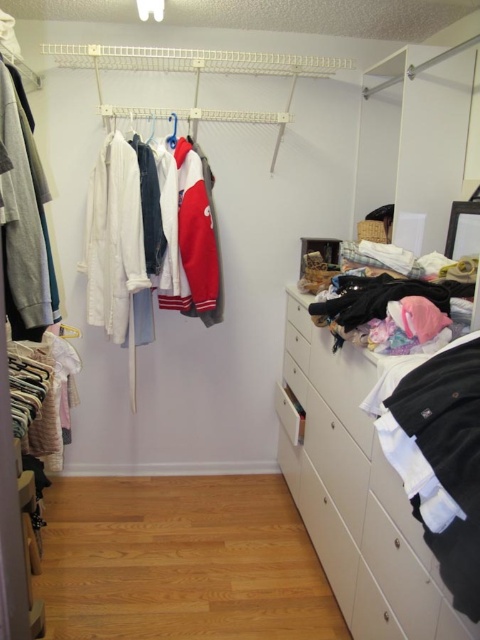
Please provide the 2D coordinates of the white glossy dresser at lower right in the closet image described.

The white glossy dresser at lower right is located at coordinates 0.780 in the x axis and 0.748 in the y axis.

You are standing in the walk_in closet and want to place a pair of shoes on the white glossy dresser at lower right. Based on the scene description, can you determine if the dresser is large enough to accommodate the shoes?

The white glossy dresser at lower right is located at point (359, 499), but without knowing the dimensions of the dresser or the shoes, it is impossible to determine if there is enough space. More information is needed to answer this question.

In the scene shown: You are organizing your closet and want to place a new pair of socks. You have two options for storage locations. One is the white plastic drawer at center, and the other is the white fabric hanger at upper left. Which storage option is closer to the middle of the closet?

The white plastic drawer at center is closer to the middle of the closet since it is positioned to the right of the white fabric hanger at upper left.